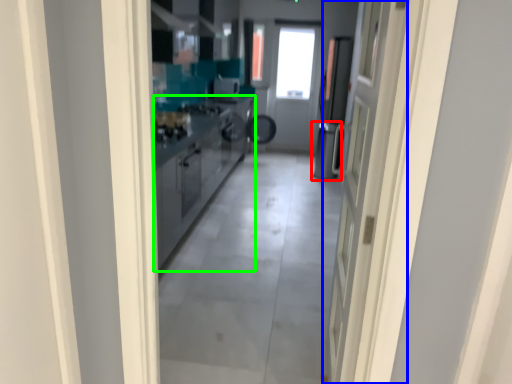
Question: Based on their relative distances, which object is farther from dish washer (highlighted by a red box)? Choose from door (highlighted by a blue box) and cabinetry (highlighted by a green box).

Choices:
 (A) door
 (B) cabinetry

Answer: (A)